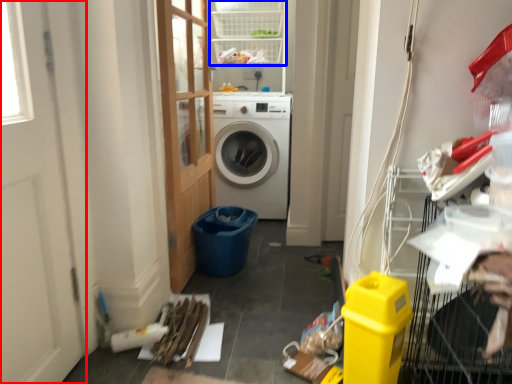
Question: Among these objects, which one is nearest to the camera, screen door (highlighted by a red box) or shelf (highlighted by a blue box)?

Choices:
 (A) screen door
 (B) shelf

Answer: (A)